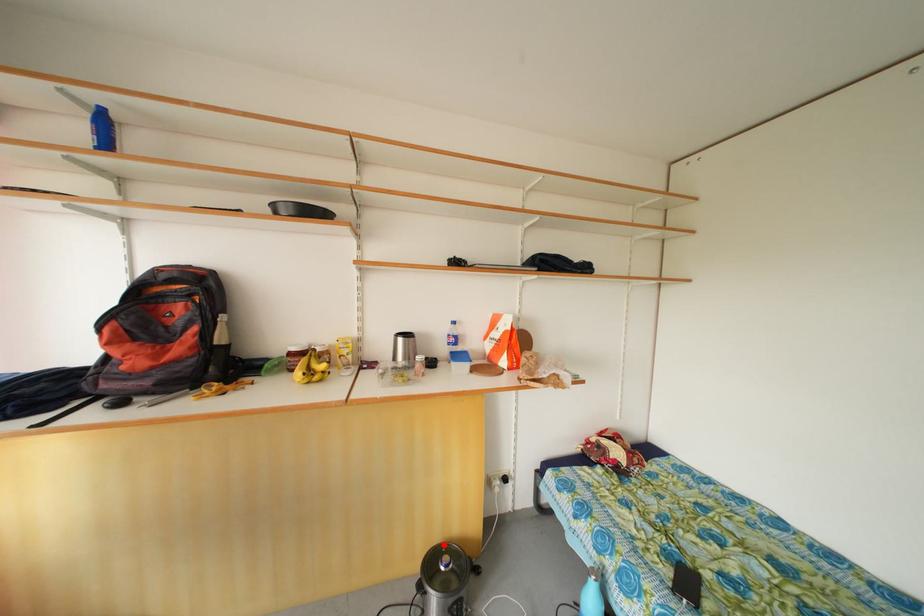
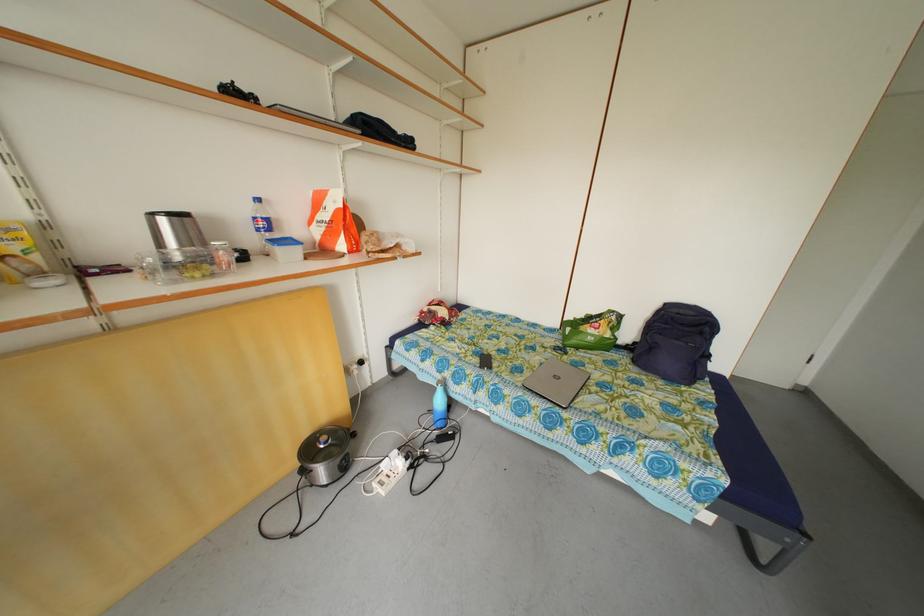
Find the pixel in the second image that matches the highlighted location in the first image.

(313, 440)